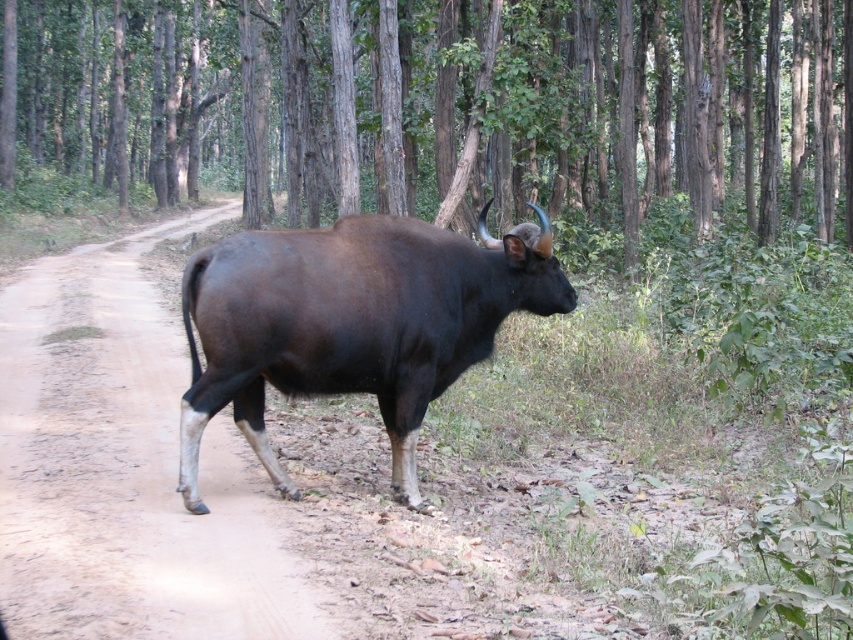
Question: Among these points, which one is nearest to the camera?

Choices:
 (A) (15, 609)
 (B) (653, 116)
 (C) (325, 280)

Answer: (A)

Question: Does brown wood tree at center have a greater width compared to brown dirt track at center?

Choices:
 (A) yes
 (B) no

Answer: (A)

Question: Estimate the real-world distances between objects in this image. Which object is farther from the brown dirt track at center?

Choices:
 (A) shiny dark brown bull at center
 (B) brown wood tree at center

Answer: (B)

Question: Is brown dirt track at center below shiny dark brown bull at center?

Choices:
 (A) yes
 (B) no

Answer: (A)

Question: Does brown dirt track at center have a smaller size compared to shiny dark brown bull at center?

Choices:
 (A) no
 (B) yes

Answer: (A)

Question: Among these objects, which one is nearest to the camera?

Choices:
 (A) brown dirt track at center
 (B) shiny dark brown bull at center
 (C) brown wood tree at center

Answer: (A)